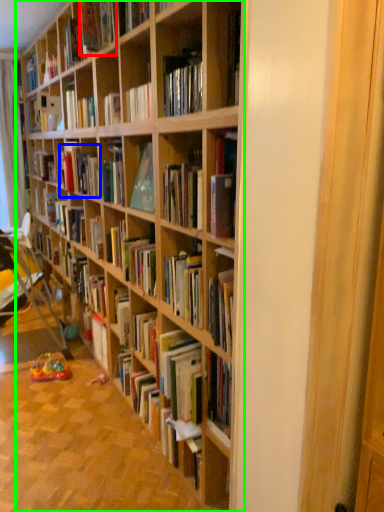
Question: Which object is positioned closest to book (highlighted by a red box)? Select from book (highlighted by a blue box) and bookcase (highlighted by a green box).

Choices:
 (A) book
 (B) bookcase

Answer: (A)